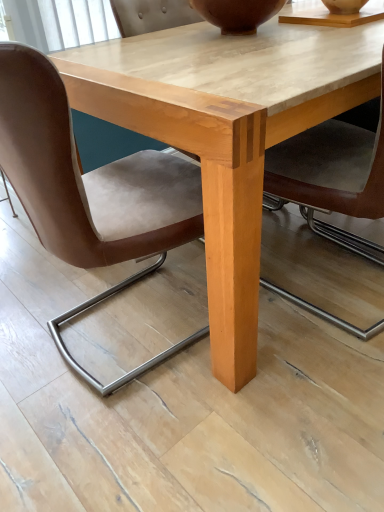
Question: From a real-world perspective, is brown leather chair at lower left on light wood table at center?

Choices:
 (A) yes
 (B) no

Answer: (A)

Question: Is brown leather chair at lower left facing towards light wood table at center?

Choices:
 (A) yes
 (B) no

Answer: (A)

Question: Considering the relative positions of brown leather chair at lower left and light wood table at center in the image provided, is brown leather chair at lower left to the left of light wood table at center from the viewer's perspective?

Choices:
 (A) yes
 (B) no

Answer: (A)

Question: Considering the relative positions of brown leather chair at lower left and light wood table at center in the image provided, is brown leather chair at lower left to the right of light wood table at center from the viewer's perspective?

Choices:
 (A) yes
 (B) no

Answer: (B)

Question: Considering the relative sizes of brown leather chair at lower left and light wood table at center in the image provided, is brown leather chair at lower left shorter than light wood table at center?

Choices:
 (A) no
 (B) yes

Answer: (A)

Question: From their relative heights in the image, would you say light wood table at center is taller or shorter than brown matte vase at upper center?

Choices:
 (A) short
 (B) tall

Answer: (B)

Question: Considering the positions of light wood table at center and brown matte vase at upper center in the image, is light wood table at center bigger or smaller than brown matte vase at upper center?

Choices:
 (A) big
 (B) small

Answer: (A)

Question: Is point (180, 90) positioned closer to the camera than point (273, 13)?

Choices:
 (A) closer
 (B) farther

Answer: (A)

Question: Is light wood table at center wider or thinner than brown matte vase at upper center?

Choices:
 (A) wide
 (B) thin

Answer: (A)

Question: From the image's perspective, relative to light wood table at center, is brown leather chair at lower left above or below?

Choices:
 (A) below
 (B) above

Answer: (A)

Question: Considering the positions of brown leather chair at lower left and light wood table at center in the image, is brown leather chair at lower left wider or thinner than light wood table at center?

Choices:
 (A) thin
 (B) wide

Answer: (A)

Question: Would you say brown leather chair at lower left is inside or outside light wood table at center?

Choices:
 (A) inside
 (B) outside

Answer: (A)

Question: Considering the positions of point (54, 154) and point (213, 37), is point (54, 154) closer or farther from the camera than point (213, 37)?

Choices:
 (A) farther
 (B) closer

Answer: (B)

Question: Based on their positions, is brown matte vase at upper center located to the left or right of light wood table at center?

Choices:
 (A) left
 (B) right

Answer: (A)

Question: From the image's perspective, is brown matte vase at upper center located above or below light wood table at center?

Choices:
 (A) below
 (B) above

Answer: (B)